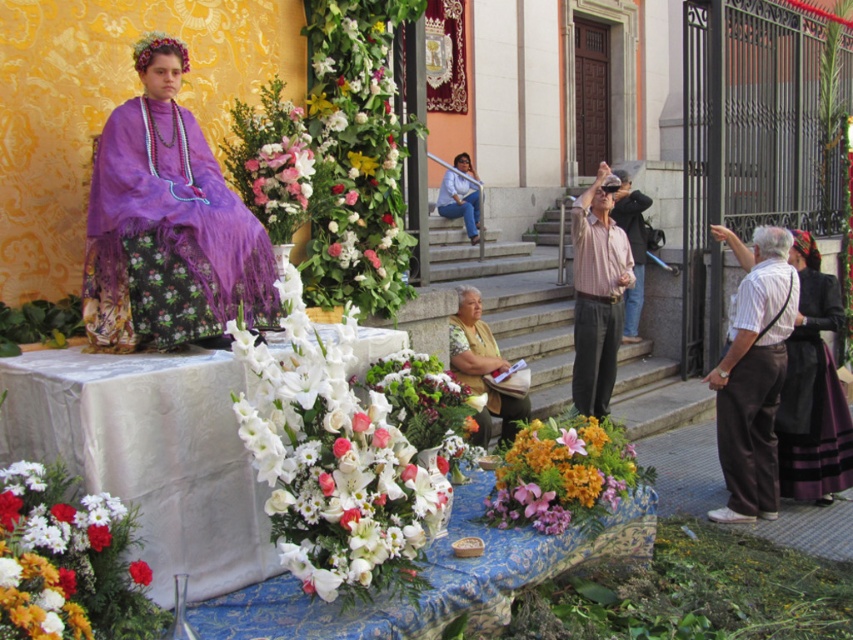
You are standing in front of the table in the scene. There are two points marked on the table surface. One is at coordinate point (749, 420) and the other is at point (492, 388). Which point is closer to you?

Point (749, 420) is closer to the viewer than point (492, 388).